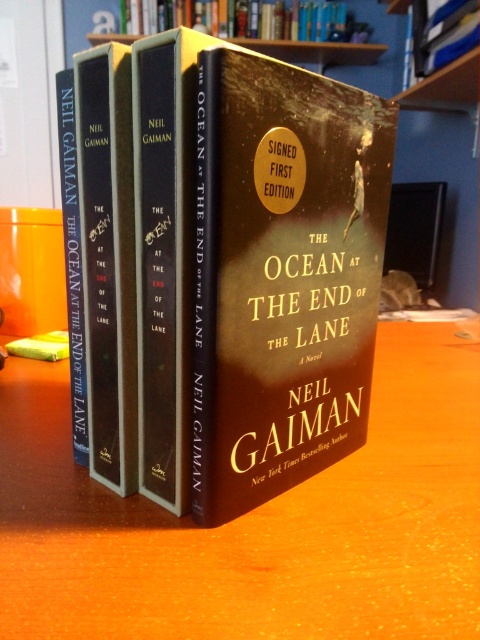
You are a photographer trying to capture the books from the camera position. Which point, point 1 at coordinates (196, 365) or point 2 at coordinates (274, 32), would appear larger in the photo?

Point 1 at coordinates (196, 365) is closer to the camera than point 2 at coordinates (274, 32), so it would appear larger in the photo.

You are looking at the image of the four books. There are two points marked on the books. The first point is at coordinate point (321, 595) and the second is at point (336, 234). Which point is closer to you?

Point (321, 595) is closer to the camera than point (336, 234).